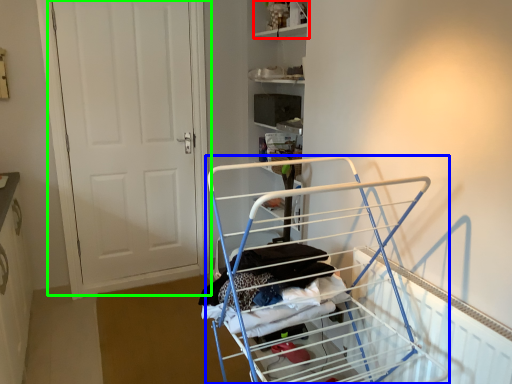
Question: Which is nearer to the shelf (highlighted by a red box)? furniture (highlighted by a blue box) or door (highlighted by a green box).

Choices:
 (A) furniture
 (B) door

Answer: (B)